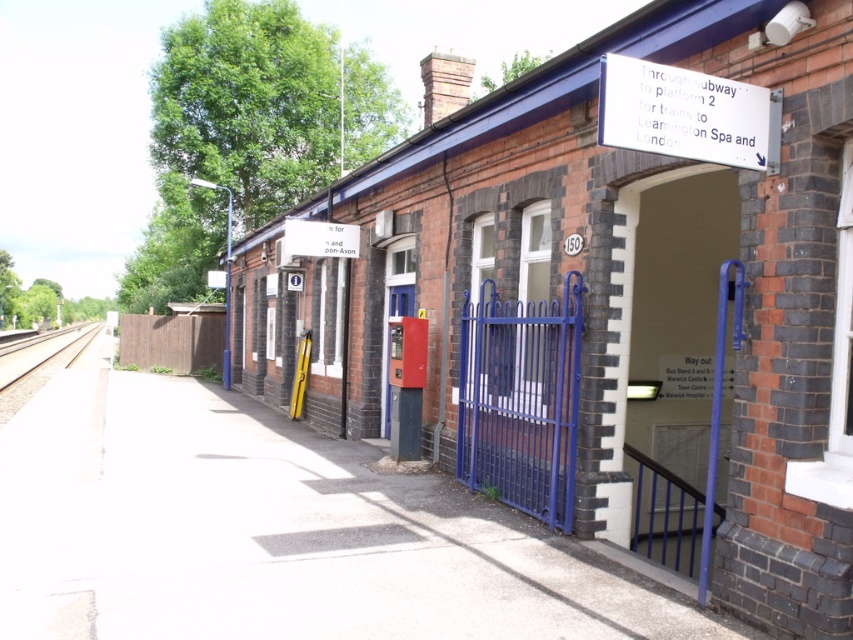
You are a passenger at the station and want to read both the white plastic sign at upper right and the white paper sign at center. Which one do you need to look at first to see the destination information for trains to London?

The white plastic sign at upper right is in front of the white paper sign at center, so you should look at the white plastic sign at upper right first to see the destination information for trains to London.

You are a station worker who needs to place a new sign that is 2 meters wide. You have the white plastic sign at upper right and the smooth concrete train track at left in view. Which object can accommodate the new sign in terms of width?

The smooth concrete train track at left can accommodate the new 2 meter wide sign since the white plastic sign at upper right is narrower than it.

You are a maintenance worker needing to place a 0.5 meter wide tool box on the platform. You have two spots available between the smooth concrete train track at left and the white paper sign at center. Which spot has enough space for the tool box?

The smooth concrete train track at left has a width larger than the white paper sign at center, so placing the tool box between the smooth concrete train track at left and the white paper sign at center would require checking the space between them. However, since the track itself is wider, the area adjacent to it might offer sufficient space. But according to the description, the track is wider than the sign, but the exact spacing between them isn not provided. Wait, the objects description says the track